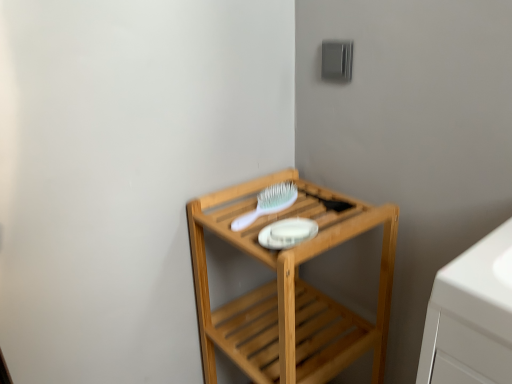
Question: From the image's perspective, is natural wood shelf at center located above or below white plastic brush at upper center?

Choices:
 (A) above
 (B) below

Answer: (B)

Question: Looking at the image, does natural wood shelf at center seem bigger or smaller compared to white plastic brush at upper center?

Choices:
 (A) big
 (B) small

Answer: (A)

Question: Is natural wood shelf at center spatially inside white plastic brush at upper center, or outside of it?

Choices:
 (A) outside
 (B) inside

Answer: (A)

Question: Is point (247, 223) closer or farther from the camera than point (268, 304)?

Choices:
 (A) closer
 (B) farther

Answer: (A)

Question: Relative to natural wood shelf at center, is white plastic brush at upper center in front or behind?

Choices:
 (A) front
 (B) behind

Answer: (B)

Question: From the image's perspective, is white plastic brush at upper center above or below natural wood shelf at center?

Choices:
 (A) below
 (B) above

Answer: (B)

Question: In terms of size, does white plastic brush at upper center appear bigger or smaller than natural wood shelf at center?

Choices:
 (A) small
 (B) big

Answer: (A)